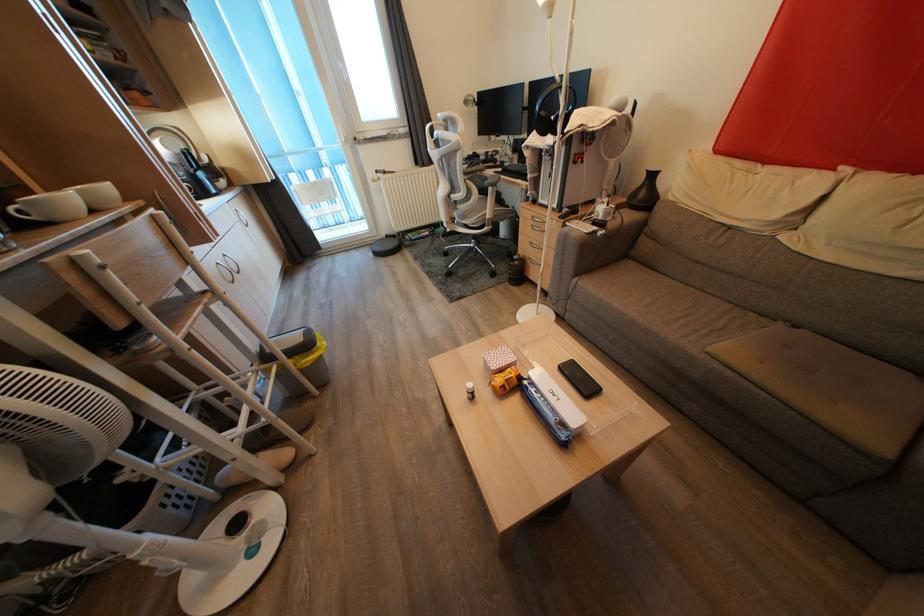
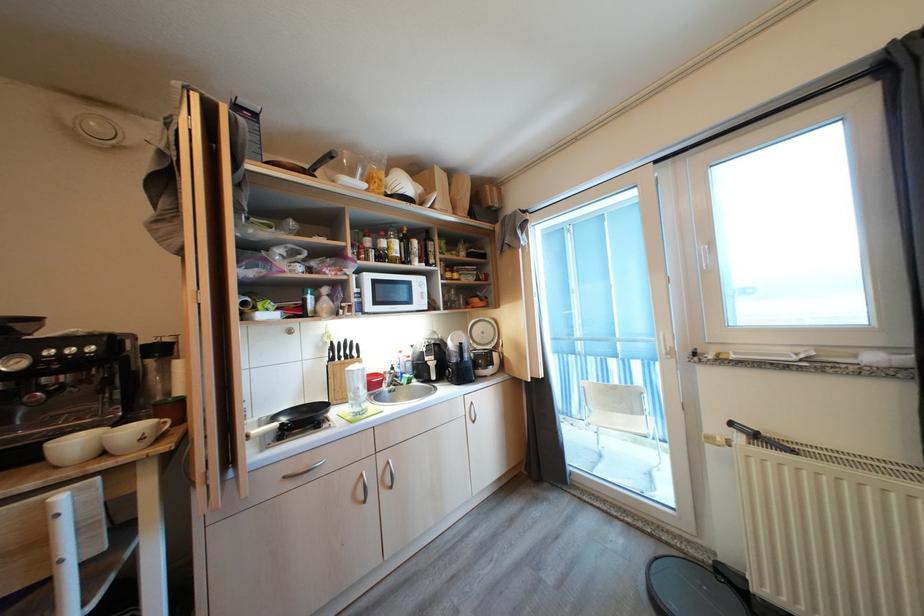
In the second image, find the point that corresponds to point 388,177 in the first image.

(760, 440)